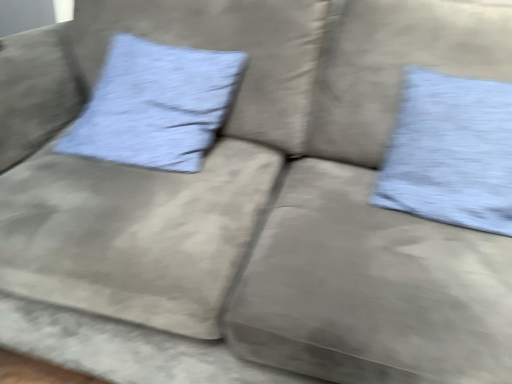
Locate an element on the screen. Image resolution: width=512 pixels, height=384 pixels. light blue textured pillow at upper right, marked as the 1th pillow in a right-to-left arrangement is located at coordinates (451, 152).

Image resolution: width=512 pixels, height=384 pixels. What do you see at coordinates (451, 152) in the screenshot?
I see `light blue textured pillow at upper right, the 2th pillow when ordered from left to right` at bounding box center [451, 152].

What is the approximate height of light blue textured pillow at upper right, the 2th pillow when ordered from left to right?

It is 39.15 centimeters.

This screenshot has height=384, width=512. What do you see at coordinates (156, 105) in the screenshot? I see `blue textured pillow at upper left, the 1th pillow positioned from the left` at bounding box center [156, 105].

Identify the location of blue textured pillow at upper left, the 1th pillow positioned from the left. point(156,105).

Consider the image. In order to face blue textured pillow at upper left, the 1th pillow positioned from the left, should I rotate leftwards or rightwards?

You should rotate left by 14.195 degrees.

Image resolution: width=512 pixels, height=384 pixels. Find the location of `light blue textured pillow at upper right, the 2th pillow when ordered from left to right`. light blue textured pillow at upper right, the 2th pillow when ordered from left to right is located at coordinates (451, 152).

Which is more to the left, light blue textured pillow at upper right, the 2th pillow when ordered from left to right, or blue textured pillow at upper left, the 1th pillow positioned from the left?

blue textured pillow at upper left, the 1th pillow positioned from the left.

Does light blue textured pillow at upper right, the 2th pillow when ordered from left to right, lie in front of blue textured pillow at upper left, the second pillow from the right?

Yes, light blue textured pillow at upper right, the 2th pillow when ordered from left to right, is in front of blue textured pillow at upper left, the second pillow from the right.

Does point (497, 127) come in front of point (169, 130)?

Yes, point (497, 127) is in front of point (169, 130).

From the image's perspective, does light blue textured pillow at upper right, marked as the 1th pillow in a right-to-left arrangement, appear lower than blue textured pillow at upper left, the second pillow from the right?

Correct, light blue textured pillow at upper right, marked as the 1th pillow in a right-to-left arrangement, appears lower than blue textured pillow at upper left, the second pillow from the right, in the image.

Based on the photo, from a real-world perspective, is light blue textured pillow at upper right, marked as the 1th pillow in a right-to-left arrangement, physically located above or below blue textured pillow at upper left, the 1th pillow positioned from the left?

light blue textured pillow at upper right, marked as the 1th pillow in a right-to-left arrangement, is above blue textured pillow at upper left, the 1th pillow positioned from the left.

Which object is wider, light blue textured pillow at upper right, marked as the 1th pillow in a right-to-left arrangement, or blue textured pillow at upper left, the second pillow from the right?

blue textured pillow at upper left, the second pillow from the right.

Who is shorter, light blue textured pillow at upper right, the 2th pillow when ordered from left to right, or blue textured pillow at upper left, the 1th pillow positioned from the left?

blue textured pillow at upper left, the 1th pillow positioned from the left.

Which of these two, light blue textured pillow at upper right, marked as the 1th pillow in a right-to-left arrangement, or blue textured pillow at upper left, the second pillow from the right, is bigger?

With larger size is blue textured pillow at upper left, the second pillow from the right.

Is blue textured pillow at upper left, the 1th pillow positioned from the left, completely or partially inside light blue textured pillow at upper right, marked as the 1th pillow in a right-to-left arrangement?

Definitely not — blue textured pillow at upper left, the 1th pillow positioned from the left, is not inside light blue textured pillow at upper right, marked as the 1th pillow in a right-to-left arrangement.

Is light blue textured pillow at upper right, marked as the 1th pillow in a right-to-left arrangement, in contact with blue textured pillow at upper left, the second pillow from the right?

They are not placed beside each other.

Is light blue textured pillow at upper right, marked as the 1th pillow in a right-to-left arrangement, aimed at blue textured pillow at upper left, the 1th pillow positioned from the left?

No, light blue textured pillow at upper right, marked as the 1th pillow in a right-to-left arrangement, is not turned towards blue textured pillow at upper left, the 1th pillow positioned from the left.

What's the angular difference between light blue textured pillow at upper right, marked as the 1th pillow in a right-to-left arrangement, and blue textured pillow at upper left, the 1th pillow positioned from the left,'s facing directions?

There is a 0.381-degree angle between the facing directions of light blue textured pillow at upper right, marked as the 1th pillow in a right-to-left arrangement, and blue textured pillow at upper left, the 1th pillow positioned from the left.

You are a GUI agent. You are given a task and a screenshot of the screen. Output one action in this format:
    pyautogui.click(x=<x>, y=<y>)
    Task: Click on the pillow on the right of blue textured pillow at upper left, the 1th pillow positioned from the left
    The height and width of the screenshot is (384, 512).
    Given the screenshot: What is the action you would take?
    pyautogui.click(x=451, y=152)

Between blue textured pillow at upper left, the 1th pillow positioned from the left, and light blue textured pillow at upper right, the 2th pillow when ordered from left to right, which one appears on the right side from the viewer's perspective?

light blue textured pillow at upper right, the 2th pillow when ordered from left to right.

Which is behind, blue textured pillow at upper left, the second pillow from the right, or light blue textured pillow at upper right, marked as the 1th pillow in a right-to-left arrangement?

blue textured pillow at upper left, the second pillow from the right, is behind.

Considering the points (114, 133) and (477, 131), which point is behind, point (114, 133) or point (477, 131)?

The point (114, 133) is farther from the camera.

From the image's perspective, is blue textured pillow at upper left, the second pillow from the right, located above or below light blue textured pillow at upper right, marked as the 1th pillow in a right-to-left arrangement?

Clearly, from the image's perspective, blue textured pillow at upper left, the second pillow from the right, is above light blue textured pillow at upper right, marked as the 1th pillow in a right-to-left arrangement.

Based on the photo, from a real-world perspective, is blue textured pillow at upper left, the 1th pillow positioned from the left, located beneath light blue textured pillow at upper right, marked as the 1th pillow in a right-to-left arrangement?

Indeed, from a real-world perspective, blue textured pillow at upper left, the 1th pillow positioned from the left, is positioned beneath light blue textured pillow at upper right, marked as the 1th pillow in a right-to-left arrangement.

Can you confirm if blue textured pillow at upper left, the second pillow from the right, is thinner than light blue textured pillow at upper right, the 2th pillow when ordered from left to right?

Incorrect, the width of blue textured pillow at upper left, the second pillow from the right, is not less than that of light blue textured pillow at upper right, the 2th pillow when ordered from left to right.

Considering the sizes of objects blue textured pillow at upper left, the 1th pillow positioned from the left, and light blue textured pillow at upper right, marked as the 1th pillow in a right-to-left arrangement, in the image provided, who is taller, blue textured pillow at upper left, the 1th pillow positioned from the left, or light blue textured pillow at upper right, marked as the 1th pillow in a right-to-left arrangement,?

Standing taller between the two is light blue textured pillow at upper right, marked as the 1th pillow in a right-to-left arrangement.

Looking at the image, does blue textured pillow at upper left, the second pillow from the right, seem bigger or smaller compared to light blue textured pillow at upper right, marked as the 1th pillow in a right-to-left arrangement?

In the image, blue textured pillow at upper left, the second pillow from the right, appears to be larger than light blue textured pillow at upper right, marked as the 1th pillow in a right-to-left arrangement.

Does blue textured pillow at upper left, the second pillow from the right, contain light blue textured pillow at upper right, the 2th pillow when ordered from left to right?

No, light blue textured pillow at upper right, the 2th pillow when ordered from left to right, is not surrounded by blue textured pillow at upper left, the second pillow from the right.

Is there a large distance between blue textured pillow at upper left, the second pillow from the right, and light blue textured pillow at upper right, the 2th pillow when ordered from left to right?

They are positioned close to each other.

Is blue textured pillow at upper left, the 1th pillow positioned from the left, aimed at light blue textured pillow at upper right, marked as the 1th pillow in a right-to-left arrangement?

No, blue textured pillow at upper left, the 1th pillow positioned from the left, is not facing towards light blue textured pillow at upper right, marked as the 1th pillow in a right-to-left arrangement.

The width and height of the screenshot is (512, 384). Identify the location of pillow lying above the light blue textured pillow at upper right, marked as the 1th pillow in a right-to-left arrangement (from the image's perspective). (156, 105).

The height and width of the screenshot is (384, 512). I want to click on pillow below the light blue textured pillow at upper right, the 2th pillow when ordered from left to right (from a real-world perspective), so click(156, 105).

Locate an element on the screen. This screenshot has width=512, height=384. pillow in front of the blue textured pillow at upper left, the 1th pillow positioned from the left is located at coordinates (451, 152).